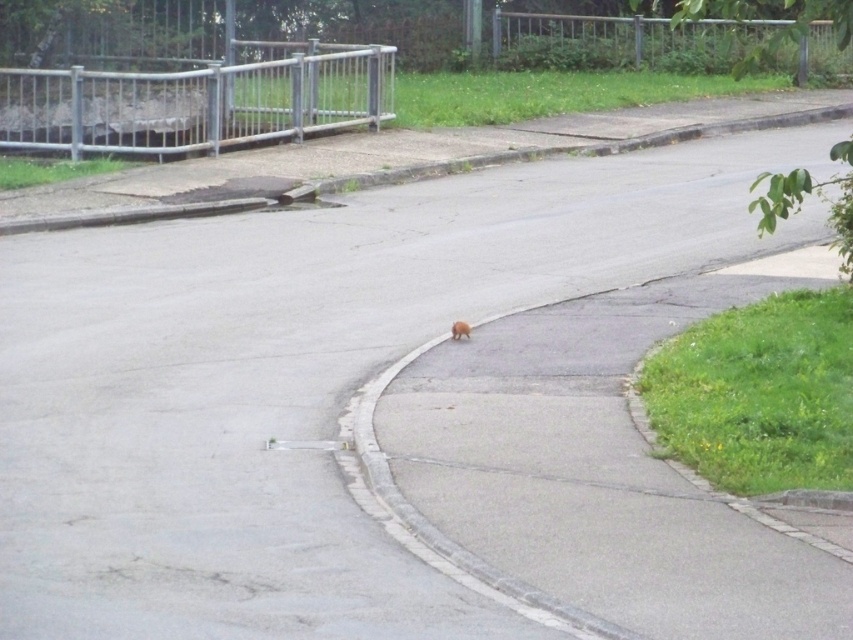
Question: Does gray concrete curb at upper center come in front of brown furry dog at center?

Choices:
 (A) no
 (B) yes

Answer: (A)

Question: Can you confirm if gray concrete curb at upper center is positioned to the right of brushed metal fence at upper left?

Choices:
 (A) yes
 (B) no

Answer: (A)

Question: Is the position of brushed metal fence at upper left less distant than that of brown furry dog at center?

Choices:
 (A) no
 (B) yes

Answer: (A)

Question: Estimate the real-world distances between objects in this image. Which object is closer to the brushed metal fence at upper left?

Choices:
 (A) gray concrete curb at upper center
 (B) brown furry dog at center

Answer: (A)

Question: Which is nearer to the brushed metal fence at upper left?

Choices:
 (A) gray concrete curb at upper center
 (B) brown furry dog at center

Answer: (A)

Question: Which object appears farthest from the camera in this image?

Choices:
 (A) brown furry dog at center
 (B) brushed metal fence at upper left
 (C) gray concrete curb at upper center

Answer: (B)